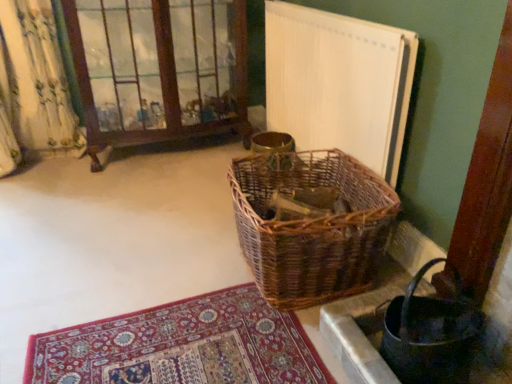
Question: Is woven brown basket at lower right positioned with its back to white textured radiator at upper right?

Choices:
 (A) no
 (B) yes

Answer: (A)

Question: Is woven brown basket at lower right smaller than white textured radiator at upper right?

Choices:
 (A) yes
 (B) no

Answer: (A)

Question: Does woven brown basket at lower right appear on the left side of white textured radiator at upper right?

Choices:
 (A) no
 (B) yes

Answer: (A)

Question: Does woven brown basket at lower right touch white textured radiator at upper right?

Choices:
 (A) no
 (B) yes

Answer: (A)

Question: Is woven brown basket at lower right behind white textured radiator at upper right?

Choices:
 (A) no
 (B) yes

Answer: (A)

Question: Is white textured radiator at upper right surrounded by woven brown basket at lower right?

Choices:
 (A) no
 (B) yes

Answer: (A)

Question: Considering the relative positions of white textured radiator at upper right and woven brown basket at lower right in the image provided, is white textured radiator at upper right to the right of woven brown basket at lower right from the viewer's perspective?

Choices:
 (A) no
 (B) yes

Answer: (A)

Question: Can you confirm if white textured radiator at upper right is wider than woven brown basket at lower right?

Choices:
 (A) yes
 (B) no

Answer: (B)

Question: Is there a large distance between white textured radiator at upper right and woven brown basket at lower right?

Choices:
 (A) no
 (B) yes

Answer: (A)

Question: Is white textured radiator at upper right with woven brown basket at lower right?

Choices:
 (A) no
 (B) yes

Answer: (A)

Question: Can you confirm if white textured radiator at upper right is shorter than woven brown basket at lower right?

Choices:
 (A) no
 (B) yes

Answer: (A)

Question: From a real-world perspective, is white textured radiator at upper right on top of woven brown basket at lower right?

Choices:
 (A) yes
 (B) no

Answer: (A)

Question: Is white textured radiator at upper right to the left of woven brown picnic basket at center from the viewer's perspective?

Choices:
 (A) no
 (B) yes

Answer: (A)